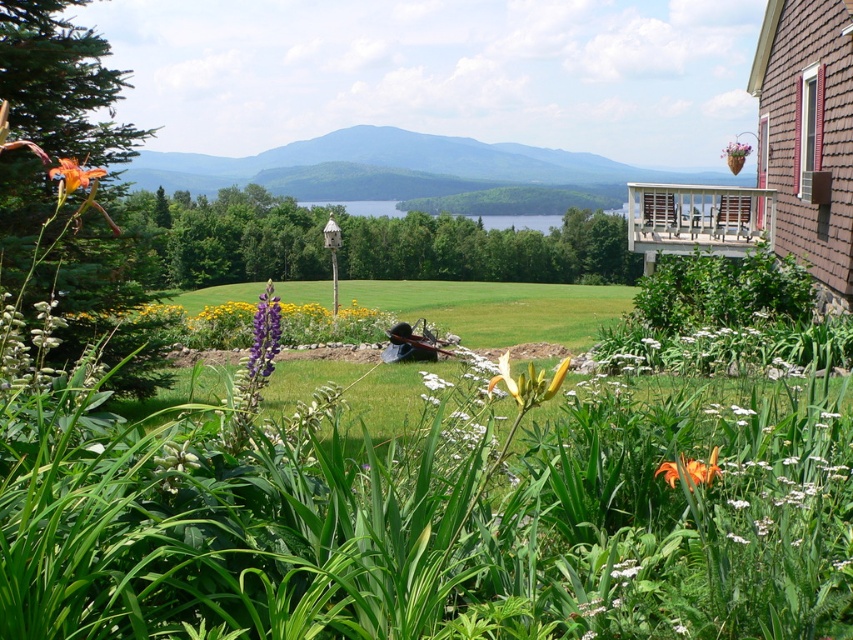
Question: Is wooden deck at upper right above matte plastic hanging basket at upper right?

Choices:
 (A) yes
 (B) no

Answer: (B)

Question: Which of the following is the farthest from the observer?

Choices:
 (A) green leafy plants at center
 (B) orange matte flower at center
 (C) matte plastic hanging basket at upper right
 (D) orange matte flower at lower left

Answer: (C)

Question: Does yellow matte flower at center have a larger size compared to orange matte flower at lower left?

Choices:
 (A) no
 (B) yes

Answer: (B)

Question: Which object is positioned farthest from the orange matte flower at center?

Choices:
 (A) orange matte flower at lower left
 (B) green leafy plants at center
 (C) yellow matte flower at center
 (D) matte plastic hanging basket at upper right

Answer: (D)

Question: Can you confirm if orange matte flower at lower left is smaller than matte plastic hanging basket at upper right?

Choices:
 (A) yes
 (B) no

Answer: (A)

Question: Which object appears farthest from the camera in this image?

Choices:
 (A) yellow matte flower at center
 (B) orange matte flower at lower left
 (C) wooden deck at upper right
 (D) orange matte flower at center

Answer: (C)